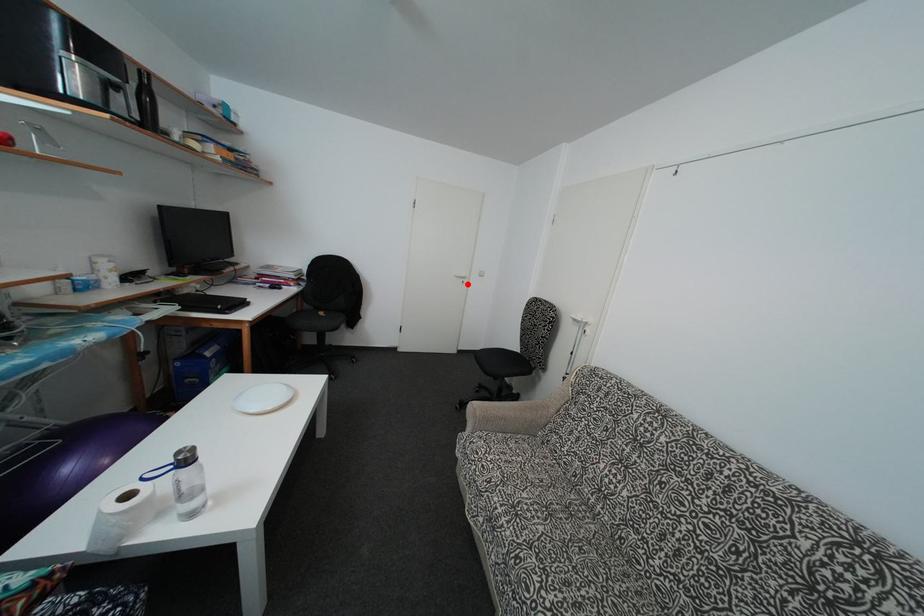
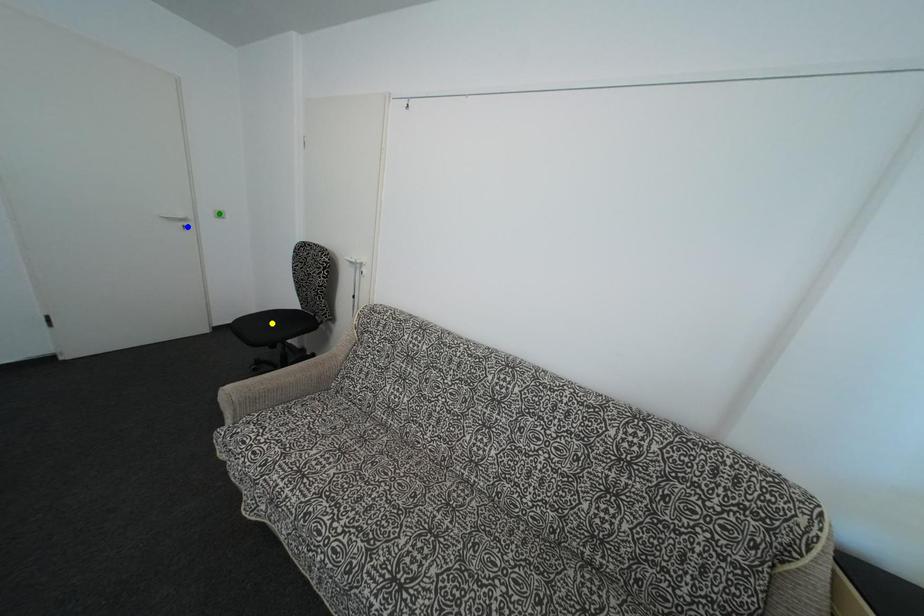
Question: I am providing you with two images of the same scene from different viewpoints. A red point is marked on the first image. You are given multiple points on the second image. Which point in image 2 represents the same 3d spot as the red point in image 1?

Choices:
 (A) yellow point
 (B) green point
 (C) blue point

Answer: (C)